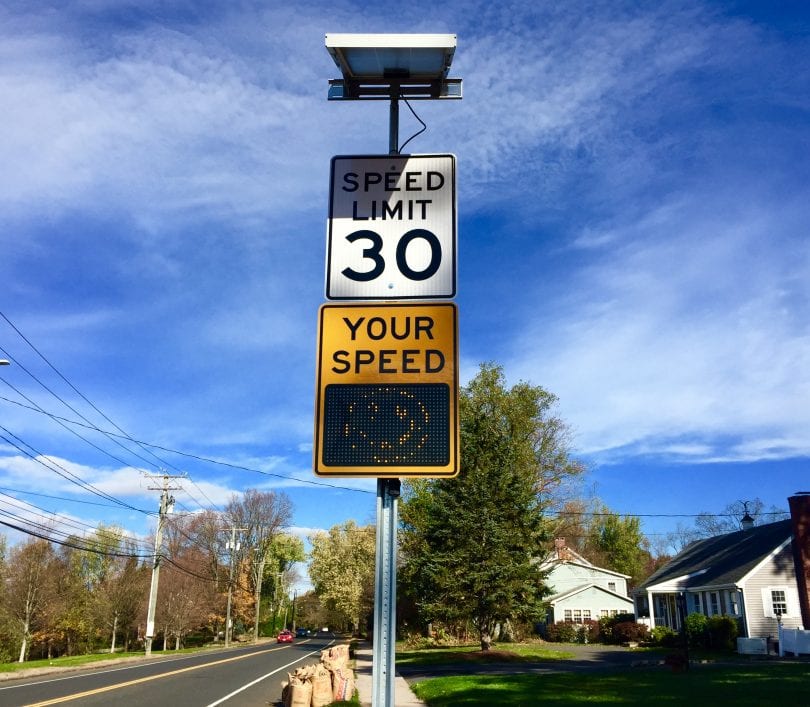
This screenshot has width=810, height=707. Identify the location of window. tap(427, 317).